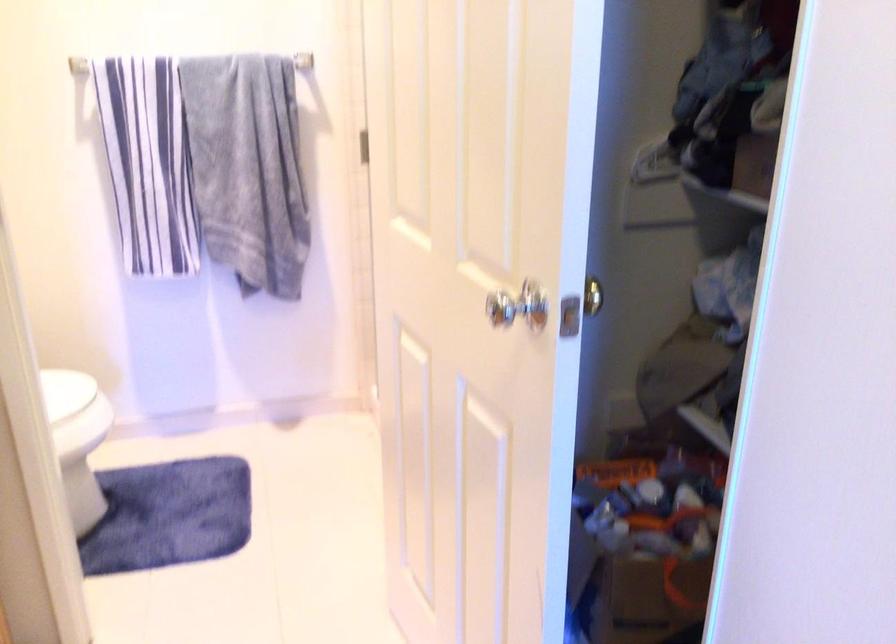
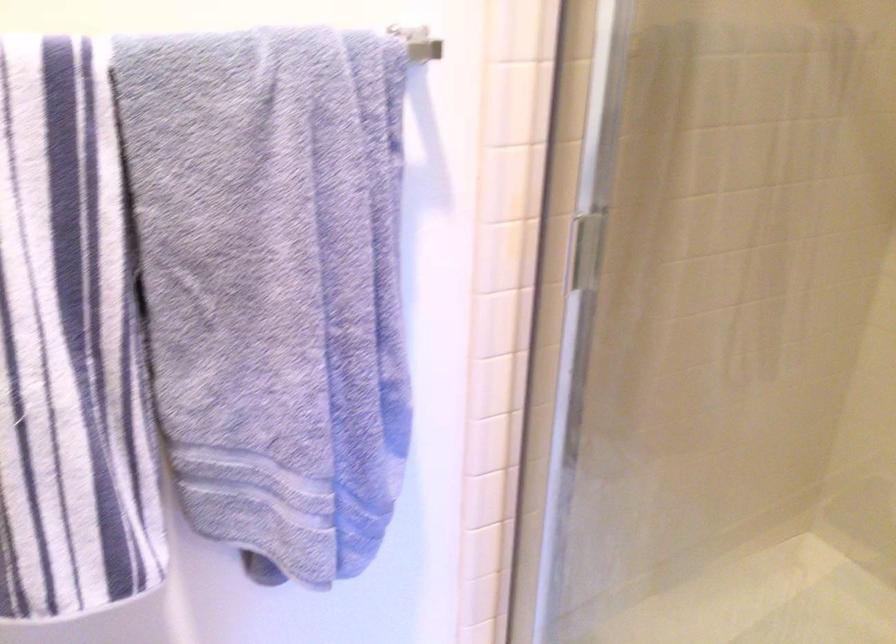
Which direction would the cameraman need to move to produce the second image?

The cameraman walked toward left, forward.